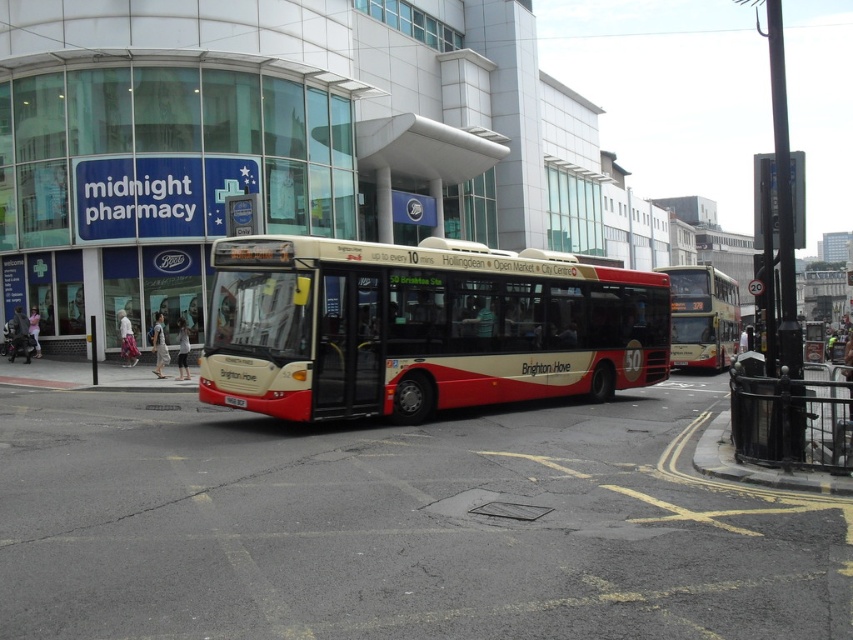
You are a pedestrian standing on the sidewalk and see both the red matte bus at center and the gold metallic bus at right. Which bus appears closer to you?

The red matte bus at center appears closer because it is smaller than the gold metallic bus at right. In perspective, smaller objects can appear closer if they are positioned in the foreground.

Looking at this image, you are standing on the sidewalk in front of the bus and want to determine which of the two points, point [326,324] or point [735,340], is closer to you. Based on the scene, which point is nearer?

Point [326,324] is closer to the viewer than point [735,340].

You are a pedestrian standing at the crosswalk and see the gold metallic bus at right and the black metal curb at lower right. Which object is closer to you?

The gold metallic bus at right is closer to you because it is positioned over the black metal curb at lower right, indicating it is in front of it from your perspective.